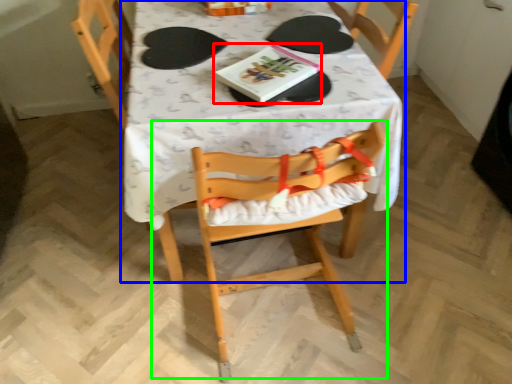
Question: Which object is positioned farthest from book (highlighted by a red box)? Select from table (highlighted by a blue box) and chair (highlighted by a green box).

Choices:
 (A) table
 (B) chair

Answer: (B)